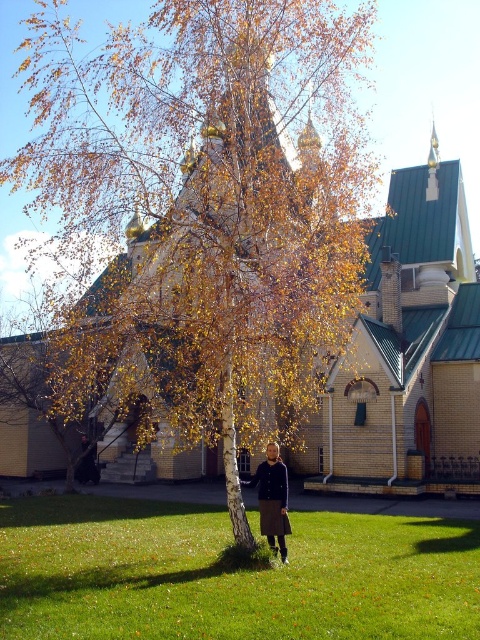
Question: Does green grass at lower center appear under golden brick church at center?

Choices:
 (A) no
 (B) yes

Answer: (B)

Question: Considering the real-world distances, which object is farthest from the dark brown leather jacket at lower center?

Choices:
 (A) green grass at lower center
 (B) golden brick church at center

Answer: (B)

Question: Which point is farther from the camera taking this photo?

Choices:
 (A) (275, 531)
 (B) (207, 524)

Answer: (B)

Question: Is dark brown leather jacket at center bigger than dark brown leather jacket at lower center?

Choices:
 (A) no
 (B) yes

Answer: (B)

Question: Among these points, which one is farthest from the camera?

Choices:
 (A) (292, 627)
 (B) (367, 337)
 (C) (82, 472)
 (D) (263, 474)

Answer: (C)

Question: Does green grass at lower center have a greater width compared to golden brick church at center?

Choices:
 (A) yes
 (B) no

Answer: (B)